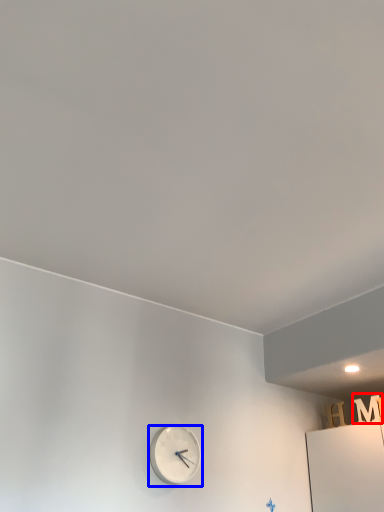
Question: Which of the following is the closest to the observer, letter (highlighted by a red box) or wall clock (highlighted by a blue box)?

Choices:
 (A) letter
 (B) wall clock

Answer: (B)